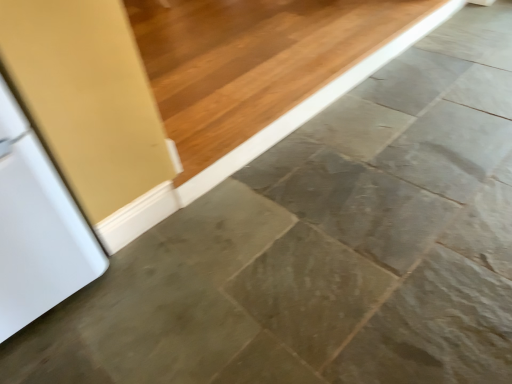
Find the location of a particular element. Image resolution: width=512 pixels, height=384 pixels. white matte refrigerator at left is located at coordinates (37, 227).

What do you see at coordinates (37, 227) in the screenshot? I see `white matte refrigerator at left` at bounding box center [37, 227].

Find the location of a particular element. This screenshot has height=384, width=512. white matte refrigerator at left is located at coordinates (37, 227).